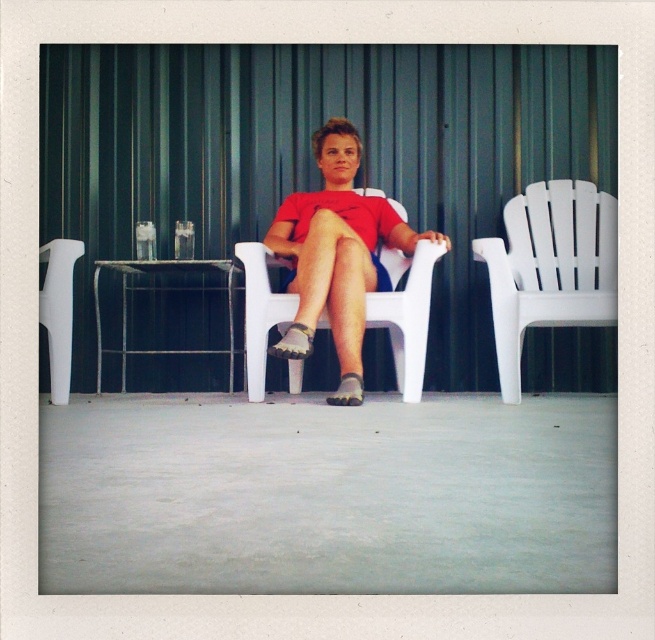
You are standing in front of the scene and want to determine which of the two points, point (409, 346) or point (54, 332), is nearer to you. Based on the spatial arrangement in the image, which point is closer?

Point (409, 346) is closer to the camera than point (54, 332), so it is the nearer point.